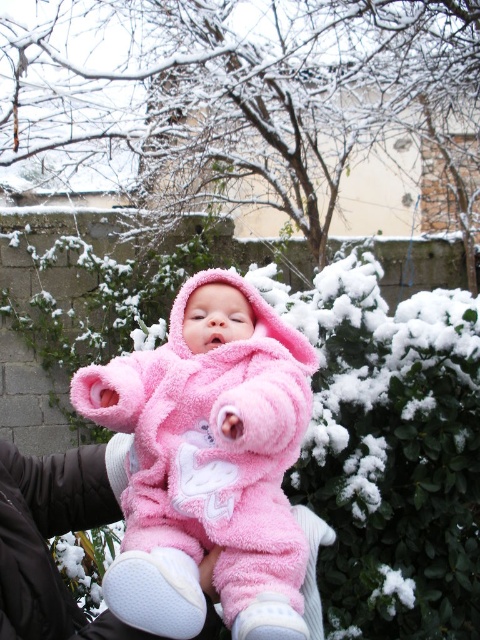
Question: Is white fluffy hedge at center smaller than pink fluffy onesie at center?

Choices:
 (A) yes
 (B) no

Answer: (B)

Question: Which of the following is the farthest from the observer?

Choices:
 (A) (227, 612)
 (B) (396, 486)

Answer: (B)

Question: Which point is closer to the camera?

Choices:
 (A) pink fluffy onesie at center
 (B) white fluffy hedge at center

Answer: (A)

Question: In this image, where is white fluffy hedge at center located relative to pink fluffy onesie at center?

Choices:
 (A) right
 (B) left

Answer: (A)

Question: Is white fluffy hedge at center further to camera compared to pink fluffy onesie at center?

Choices:
 (A) no
 (B) yes

Answer: (B)